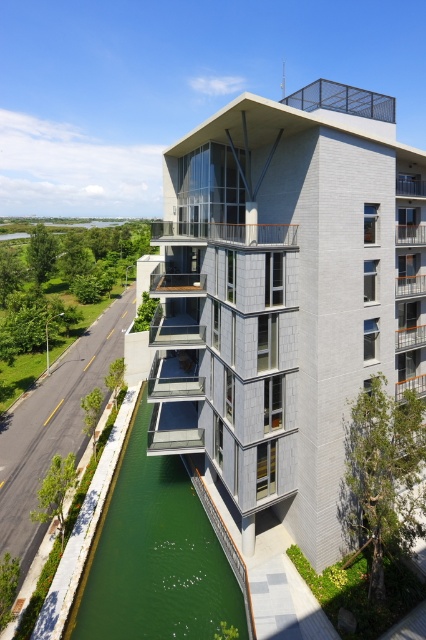
Which is more to the left, black metal balcony at upper center or wooden at center?

From the viewer's perspective, wooden at center appears more on the left side.

Can you confirm if black metal balcony at upper center is bigger than wooden at center?

Yes, black metal balcony at upper center is bigger than wooden at center.

This screenshot has width=426, height=640. Find the location of `black metal balcony at upper center`. black metal balcony at upper center is located at coordinates (342, 100).

Does glass/transparent balcony at center have a greater height compared to wooden at center?

Indeed, glass/transparent balcony at center has a greater height compared to wooden at center.

You are a GUI agent. You are given a task and a screenshot of the screen. Output one action in this format:
    pyautogui.click(x=<x>, y=<y>)
    Task: Click on the glass/transparent balcony at center
    
    Given the screenshot: What is the action you would take?
    pyautogui.click(x=224, y=234)

Does point (247, 227) come in front of point (169, 289)?

Yes.

At what (x,y) coordinates should I click in order to perform the action: click on glass/transparent balcony at center. Please return your answer as a coordinate pair (x, y). Image resolution: width=426 pixels, height=640 pixels. Looking at the image, I should click on click(224, 234).

Is black metal balcony at upper center positioned at the back of glassy concrete balcony at upper right?

No, it is not.

Does black metal balcony at upper center have a greater width compared to glassy concrete balcony at upper right?

Indeed, black metal balcony at upper center has a greater width compared to glassy concrete balcony at upper right.

Which is behind, point (365, 104) or point (414, 243)?

The point (414, 243) is behind.

The height and width of the screenshot is (640, 426). Identify the location of black metal balcony at upper center. click(x=342, y=100).